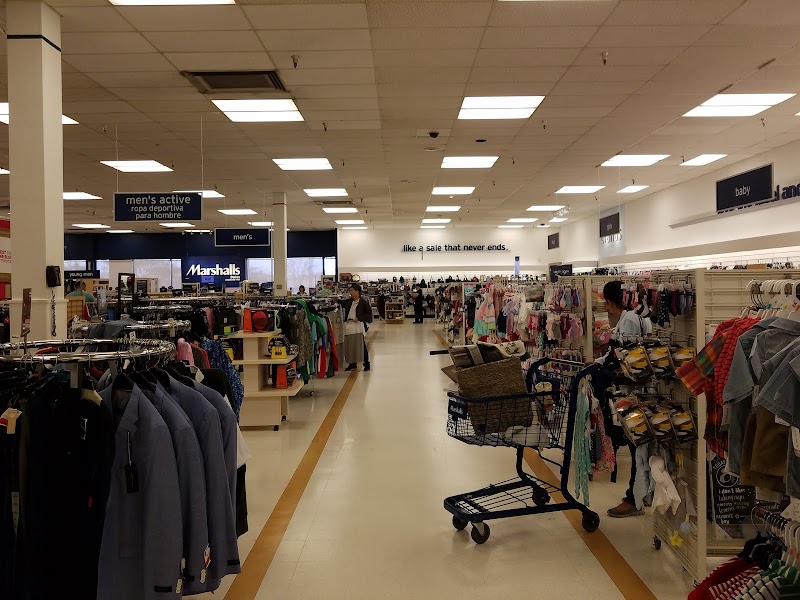
Identify the location of floor. (437, 475).